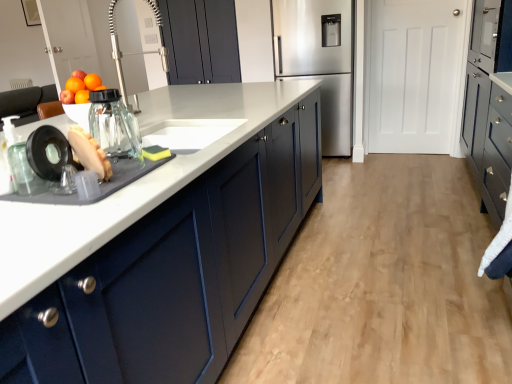
Question: In terms of width, does brown matte bread at left, which ranks as the second food in back-to-front order, look wider or thinner when compared to yellow sponge at sink, acting as the second food starting from the left?

Choices:
 (A) wide
 (B) thin

Answer: (A)

Question: In terms of height, does brown matte bread at left, which appears as the second food when viewed from the right, look taller or shorter compared to yellow sponge at sink, which is the first food in right-to-left order?

Choices:
 (A) short
 (B) tall

Answer: (B)

Question: Estimate the real-world distances between objects in this image. Which object is closer to the matte blue cabinets at center, which is the 2th cabinetry from left to right?

Choices:
 (A) white matte door at upper right
 (B) matte dark blue cabinet at right, the third cabinetry when ordered from left to right
 (C) clear glass jar at sink, the second appliance viewed from the front
 (D) matte blue cabinets at center
 (E) stainless steel refrigerator at center

Answer: (C)

Question: Which object is the farthest from the brown matte bread at left, which ranks as the second food in back-to-front order?

Choices:
 (A) matte blue cabinets at center
 (B) matte dark blue cabinet at upper center, the third cabinetry in the right-to-left sequence
 (C) white matte door at upper right
 (D) shiny glass jar at left
 (E) matte blue cabinets at center, which is the 2th cabinetry from left to right

Answer: (C)